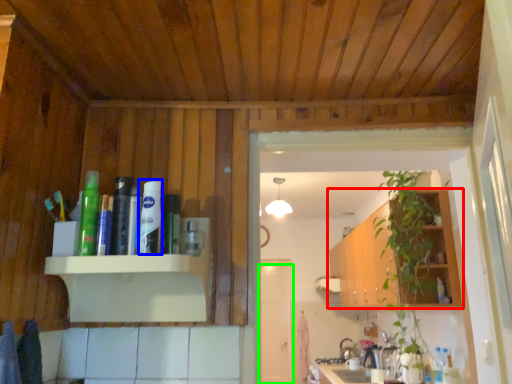
Question: Based on their relative distances, which object is farther from cabinetry (highlighted by a red box)? Choose from toiletry (highlighted by a blue box) and door (highlighted by a green box).

Choices:
 (A) toiletry
 (B) door

Answer: (A)